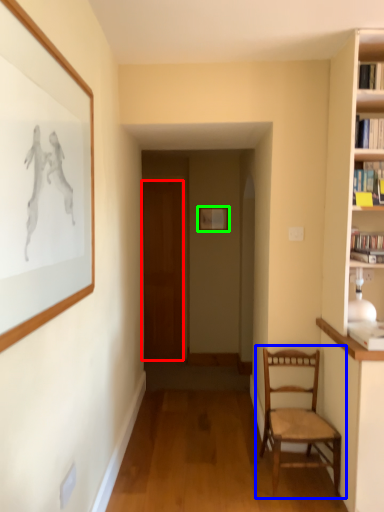
Question: Considering the real-world distances, which object is farthest from door (highlighted by a red box)? chair (highlighted by a blue box) or picture frame (highlighted by a green box)?

Choices:
 (A) chair
 (B) picture frame

Answer: (A)